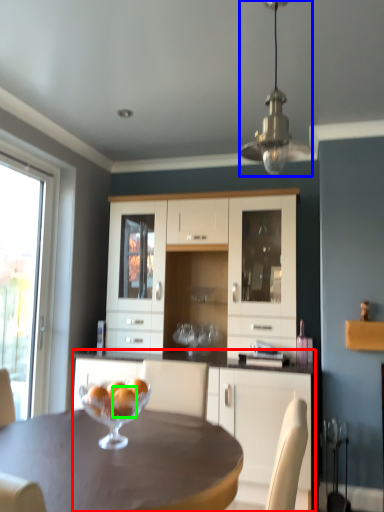
Question: Considering the real-world distances, which object is closest to cabinetry (highlighted by a red box)? lamp (highlighted by a blue box) or orange (highlighted by a green box).

Choices:
 (A) lamp
 (B) orange

Answer: (B)